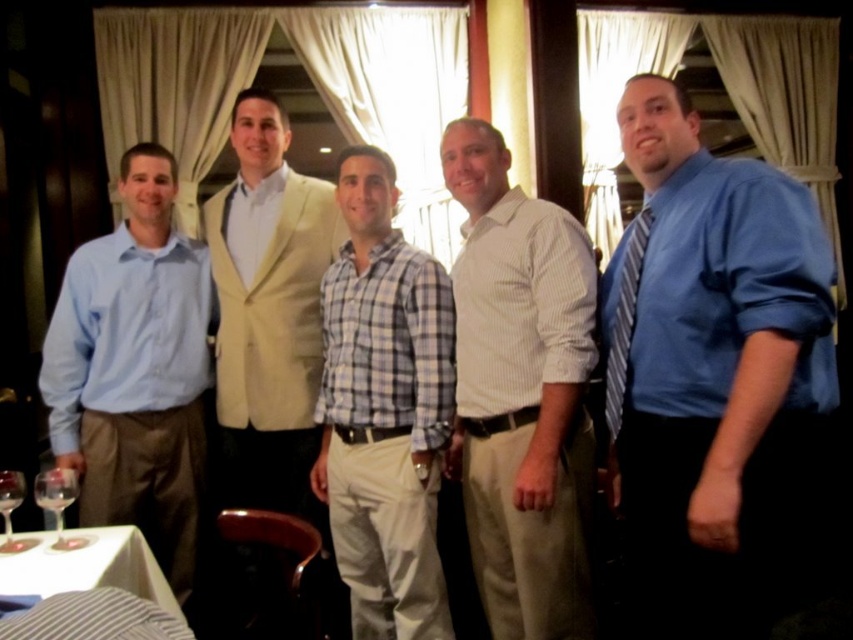
Question: Does blue satin shirt at center appear under white fabric table at lower left?

Choices:
 (A) no
 (B) yes

Answer: (A)

Question: Does light blue checkered shirt at center have a larger size compared to transparent glass at lower left?

Choices:
 (A) no
 (B) yes

Answer: (B)

Question: Estimate the real-world distances between objects in this image. Which object is farther from the white striped shirt at center?

Choices:
 (A) white fabric table at lower left
 (B) striped fabric tie at right
 (C) clear glass wine glass at lower left

Answer: (C)

Question: Is white fabric table at lower left wider than striped fabric tie at right?

Choices:
 (A) no
 (B) yes

Answer: (B)

Question: Which of the following is the closest to the observer?

Choices:
 (A) (428, 627)
 (B) (689, 250)
 (C) (636, 282)
 (D) (294, 468)

Answer: (B)

Question: Which point appears closest to the camera in this image?

Choices:
 (A) (265, 292)
 (B) (619, 390)

Answer: (B)